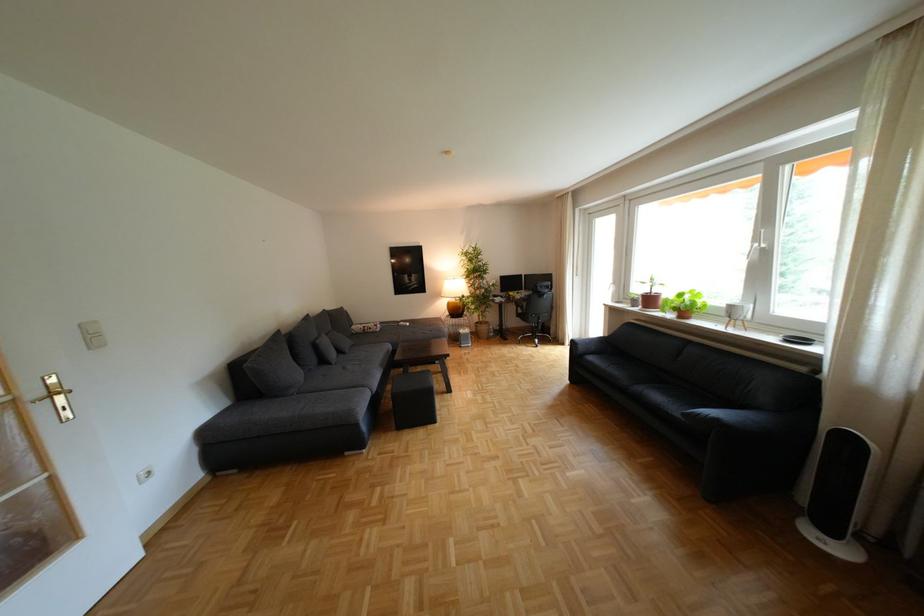
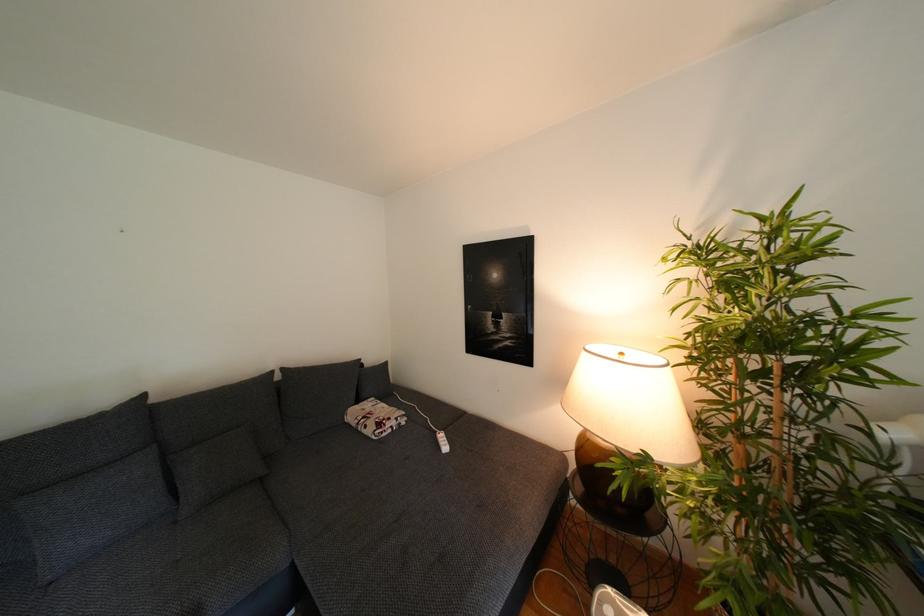
Locate, in the second image, the point that corresponds to point 383,331 in the first image.

(378, 431)